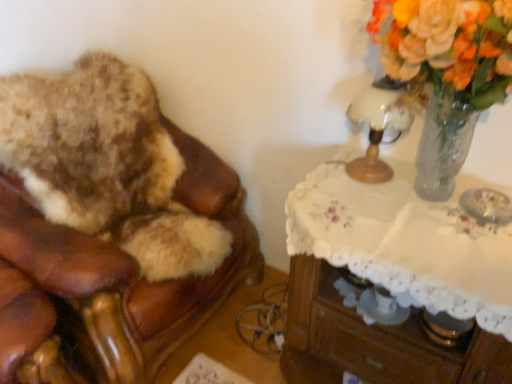
At what (x,y) coordinates should I click in order to perform the action: click on vacant region to the left of white glass table lamp at upper right. Please return your answer as a coordinate pair (x, y). Looking at the image, I should click on (322, 187).